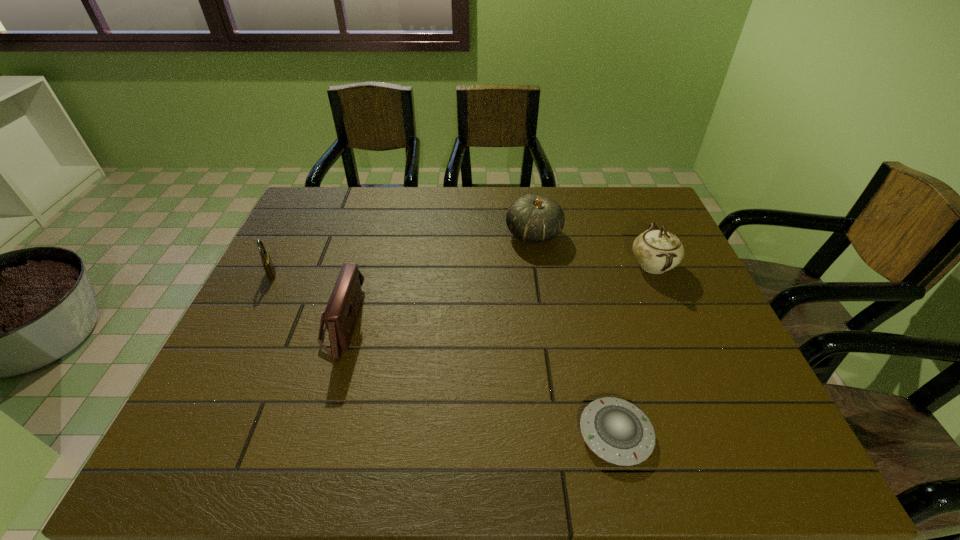
Where is `free space between the chinaware and the padlock`? Image resolution: width=960 pixels, height=540 pixels. free space between the chinaware and the padlock is located at coordinates (462, 269).

You are a GUI agent. You are given a task and a screenshot of the screen. Output one action in this format:
    pyautogui.click(x=<x>, y=<y>)
    Task: Click on the object that can be found as the third closest to the chinaware
    
    Given the screenshot: What is the action you would take?
    pyautogui.click(x=340, y=315)

Identify which object is located as the second nearest to the leftmost object. Please provide its 2D coordinates. Your answer should be formatted as a tuple, i.e. [(x, y)], where the tuple contains the x and y coordinates of a point satisfying the conditions above.

[(533, 219)]

This screenshot has height=540, width=960. Find the location of `vacant space that satisfies the following two spatial constraints: 1. on the front flap of the fourth object from right to left; 2. on the left side of the shortest object`. vacant space that satisfies the following two spatial constraints: 1. on the front flap of the fourth object from right to left; 2. on the left side of the shortest object is located at coordinates (309, 434).

Where is `vacant region that satisfies the following two spatial constraints: 1. on the front flap of the shortest object; 2. on the left side of the shoulder bag`? vacant region that satisfies the following two spatial constraints: 1. on the front flap of the shortest object; 2. on the left side of the shoulder bag is located at coordinates (309, 434).

Where is `free space that satisfies the following two spatial constraints: 1. on the front side of the chinaware; 2. on the front flap of the fourth object from right to left`? This screenshot has height=540, width=960. free space that satisfies the following two spatial constraints: 1. on the front side of the chinaware; 2. on the front flap of the fourth object from right to left is located at coordinates (678, 323).

Find the location of a particular element. The width and height of the screenshot is (960, 540). free spot that satisfies the following two spatial constraints: 1. on the front flap of the shoulder bag; 2. on the back side of the saucer is located at coordinates (309, 434).

This screenshot has height=540, width=960. What are the coordinates of `free space that satisfies the following two spatial constraints: 1. on the front flap of the shoulder bag; 2. on the left side of the shortest object` in the screenshot? It's located at (309, 434).

Locate an element on the screen. This screenshot has width=960, height=540. vacant area that satisfies the following two spatial constraints: 1. on the front flap of the shortest object; 2. on the left side of the fourth object from right to left is located at coordinates (309, 434).